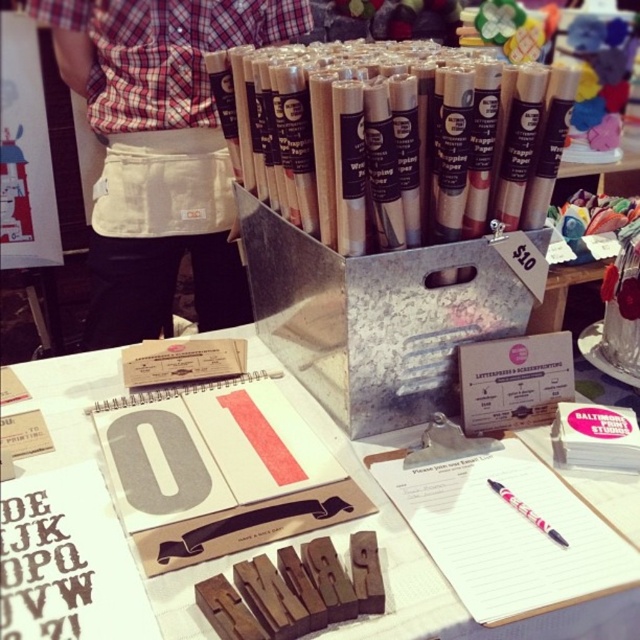
Question: Can you confirm if wooden wrapping paper rolls at upper center is positioned to the right of wooden letterpress blocks at center?

Choices:
 (A) yes
 (B) no

Answer: (A)

Question: Can you confirm if wooden wrapping paper rolls at upper center is positioned to the left of wooden letterpress blocks at center?

Choices:
 (A) yes
 (B) no

Answer: (B)

Question: Which object appears closest to the camera in this image?

Choices:
 (A) wooden wrapping paper rolls at upper center
 (B) wooden letterpress blocks at center

Answer: (B)

Question: Is wooden wrapping paper rolls at upper center thinner than wooden letterpress blocks at center?

Choices:
 (A) no
 (B) yes

Answer: (B)

Question: Which point is closer to the camera?

Choices:
 (A) wooden letterpress blocks at center
 (B) wooden wrapping paper rolls at upper center

Answer: (A)

Question: Which point is closer to the camera?

Choices:
 (A) wooden letterpress blocks at center
 (B) wooden wrapping paper rolls at upper center

Answer: (A)